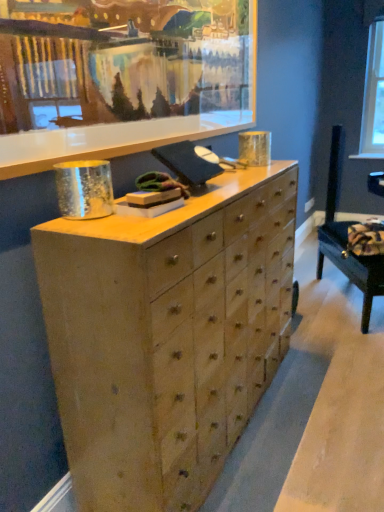
Locate an element on the screen. The width and height of the screenshot is (384, 512). vacant space to the right of natural wood chest of drawers at center is located at coordinates (319, 410).